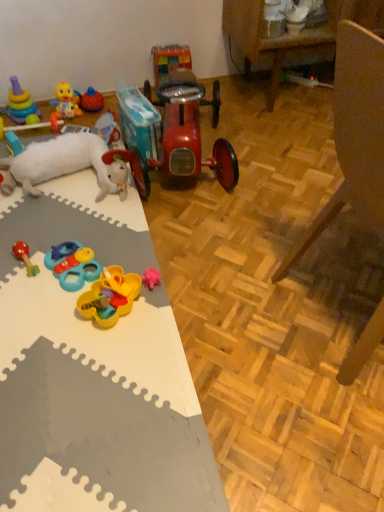
Find the location of a particular element. The width and height of the screenshot is (384, 512). vacant space in between rubber duck at center, the seventh toy positioned from the left, and rubberized red and green rattle at lower left, which ranks as the eighth toy in right-to-left order is located at coordinates (62, 211).